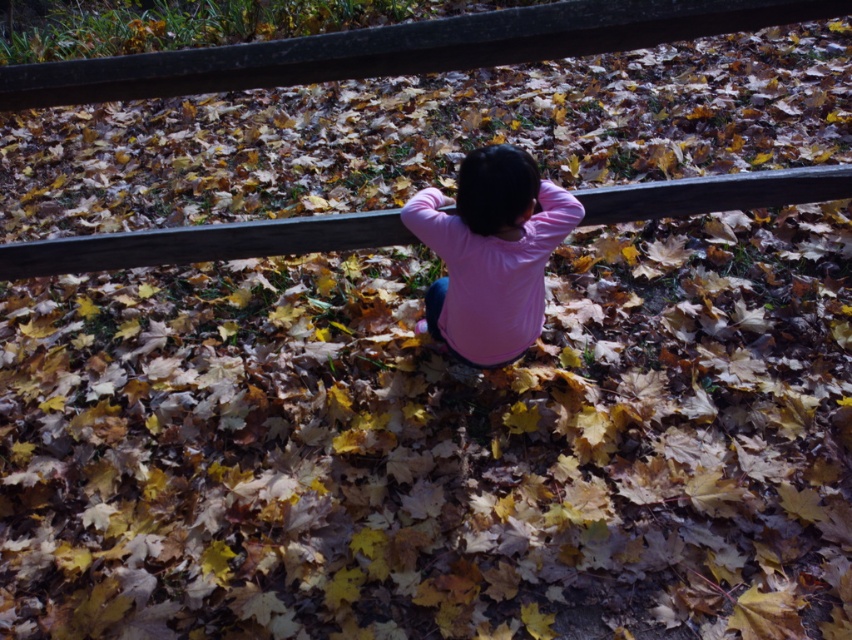
You are a photographer trying to capture the child in the scene. You notice the pink matte shirt at center and the wooden rail at center. Which object is positioned lower in the image?

The pink matte shirt at center is located below the wooden rail at center, so the pink matte shirt at center is positioned lower in the image.

You are a photographer trying to capture the child in the scene. The child is wearing a pink long sleeved shirt. The photographer wants to focus on the pink matte shirt at center. Where should the photographer aim the camera to capture the shirt? Please provide the coordinates in the format of a point like point (491, 253).

The pink matte shirt at center is located at point (491, 253). The photographer should aim the camera at point (491, 253) to capture the shirt.